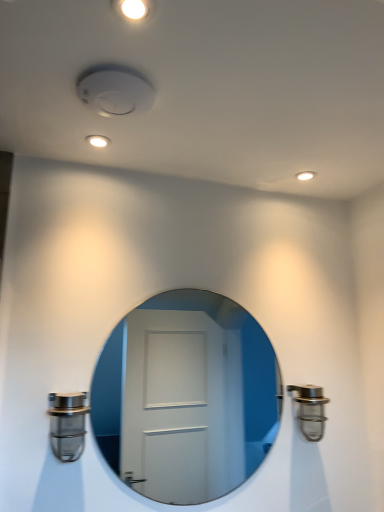
Question: From a real-world perspective, is satin nickel door handle at lower left, arranged as the 2th door handle when viewed from the back, beneath white glossy mirror at center?

Choices:
 (A) yes
 (B) no

Answer: (A)

Question: Is satin nickel door handle at lower left, which is counted as the second door handle, starting from the right, outside of white glossy mirror at center?

Choices:
 (A) yes
 (B) no

Answer: (A)

Question: Does satin nickel door handle at lower left, arranged as the 2th door handle when viewed from the back, contain white glossy mirror at center?

Choices:
 (A) no
 (B) yes

Answer: (A)

Question: Is satin nickel door handle at lower left, the 1th door handle in the left-to-right sequence, bigger than white glossy mirror at center?

Choices:
 (A) no
 (B) yes

Answer: (A)

Question: Is satin nickel door handle at lower left, which is counted as the second door handle, starting from the right, wider than white glossy mirror at center?

Choices:
 (A) no
 (B) yes

Answer: (B)

Question: From a real-world perspective, is white glossy mirror at center above or below satin nickel door handle at lower left, which is counted as the second door handle, starting from the right?

Choices:
 (A) below
 (B) above

Answer: (B)

Question: Relative to satin nickel door handle at lower left, the 1th door handle in the left-to-right sequence, is white glossy mirror at center in front or behind?

Choices:
 (A) front
 (B) behind

Answer: (B)

Question: Does point (249, 455) appear closer or farther from the camera than point (67, 439)?

Choices:
 (A) closer
 (B) farther

Answer: (B)

Question: Visually, is white glossy mirror at center positioned to the left or to the right of satin nickel door handle at lower left, arranged as the 2th door handle when viewed from the back?

Choices:
 (A) left
 (B) right

Answer: (B)

Question: Is satin nickel door handle at lower left, the 1th door handle in the left-to-right sequence, situated inside satin nickel faucet at right, the 1th door handle viewed from the back, or outside?

Choices:
 (A) inside
 (B) outside

Answer: (B)

Question: In the image, is satin nickel door handle at lower left, which is counted as the second door handle, starting from the right, positioned in front of or behind satin nickel faucet at right, the first door handle from the right?

Choices:
 (A) front
 (B) behind

Answer: (A)

Question: Is point (54, 445) positioned closer to the camera than point (307, 422)?

Choices:
 (A) farther
 (B) closer

Answer: (B)

Question: In terms of width, does satin nickel door handle at lower left, the 1th door handle in the left-to-right sequence, look wider or thinner when compared to satin nickel faucet at right, the 1th door handle viewed from the back?

Choices:
 (A) wide
 (B) thin

Answer: (A)

Question: Considering the positions of white glossy mirror at center and satin nickel faucet at right, the 1th door handle viewed from the back, in the image, is white glossy mirror at center wider or thinner than satin nickel faucet at right, the 1th door handle viewed from the back,?

Choices:
 (A) thin
 (B) wide

Answer: (A)

Question: Considering their positions, is white glossy mirror at center located in front of or behind satin nickel faucet at right, the 1th door handle viewed from the back?

Choices:
 (A) front
 (B) behind

Answer: (A)